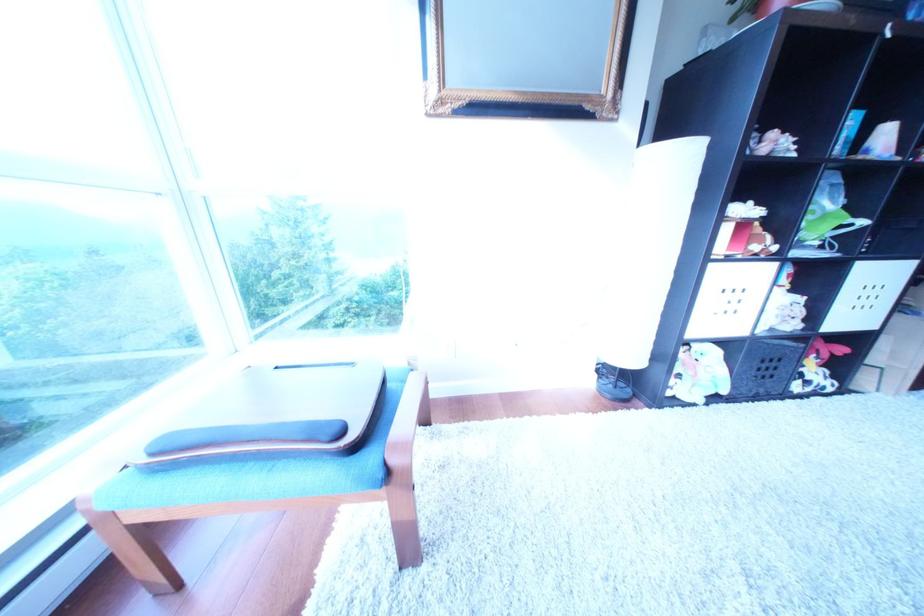
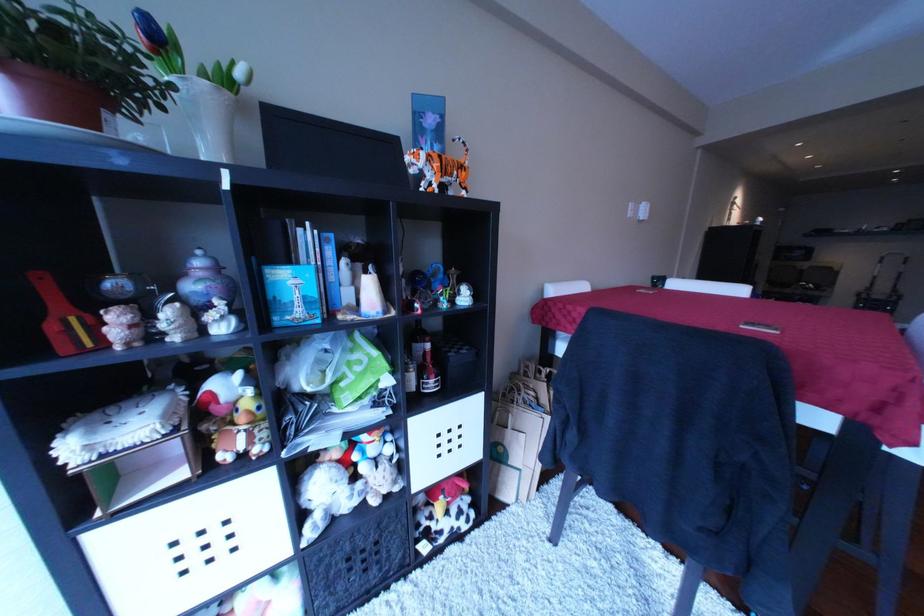
Question: In a continuous first-person perspective shot, in which direction is the camera moving?

Choices:
 (A) Left
 (B) Right
 (C) Forward
 (D) Backward

Answer: (B)